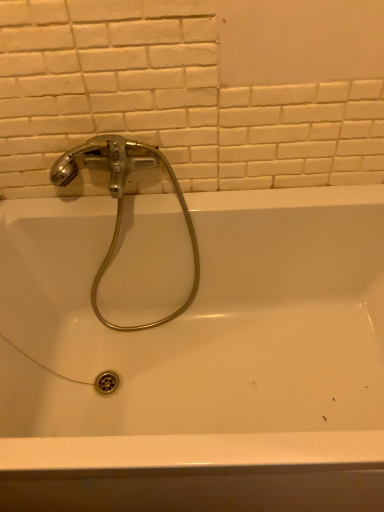
Question: From the image's perspective, is white matte ceramic tile at upper center above or below polished chrome faucet at upper left?

Choices:
 (A) below
 (B) above

Answer: (B)

Question: Based on their sizes in the image, would you say white matte ceramic tile at upper center is bigger or smaller than polished chrome faucet at upper left?

Choices:
 (A) small
 (B) big

Answer: (A)

Question: Estimate the real-world distances between objects in this image. Which object is farther from the white matte ceramic tile at upper center?

Choices:
 (A) polished chrome faucet at upper left
 (B) white glossy bathtub at upper center

Answer: (B)

Question: Which of these objects is positioned farthest from the white glossy bathtub at upper center?

Choices:
 (A) white matte ceramic tile at upper center
 (B) polished chrome faucet at upper left

Answer: (A)